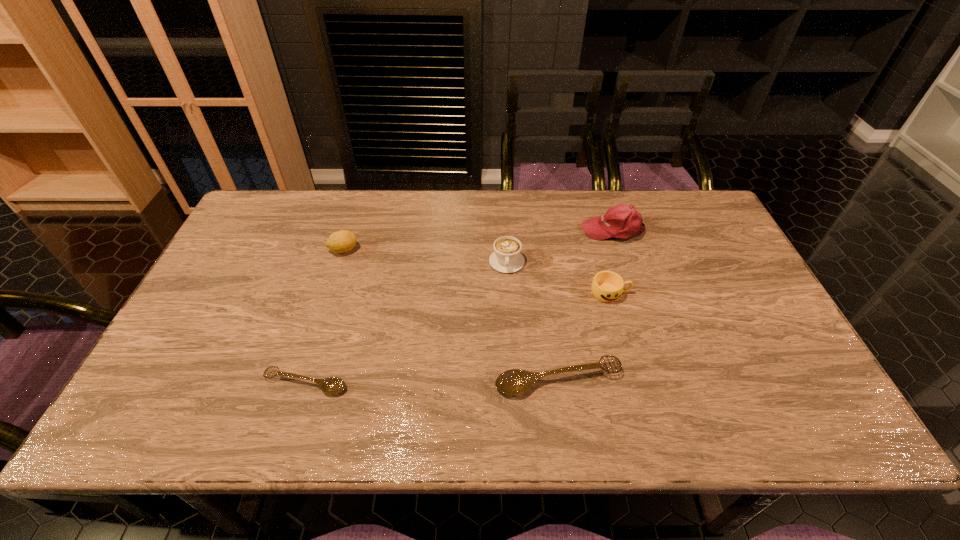
In the current image, all ladles are evenly spaced. To maintain this equal spacing, where should an additional ladle be placed on the right? Please point out a free spot. Please provide its 2D coordinates. Your answer should be formatted as a tuple, i.e. [(x, y)], where the tuple contains the x and y coordinates of a point satisfying the conditions above.

[(807, 376)]